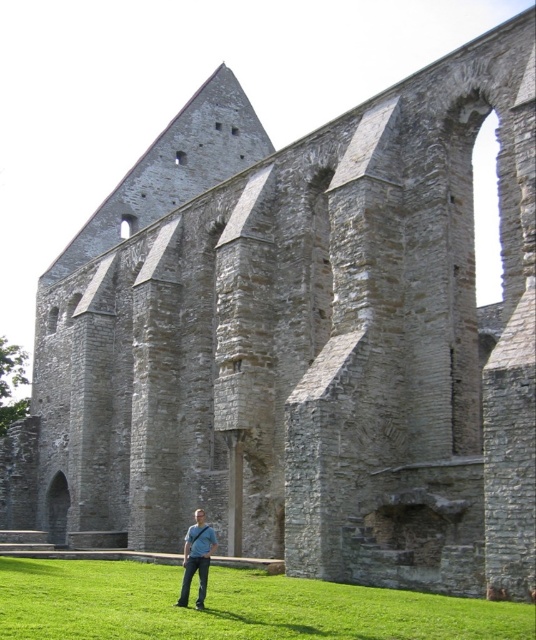
Based on the photo, who is shorter, green grass at lower center or blue denim jeans at lower center?

Standing shorter between the two is green grass at lower center.

Which is behind, point (19, 570) or point (184, 593)?

Positioned behind is point (19, 570).

Where is `green grass at lower center`? green grass at lower center is located at coordinates (230, 605).